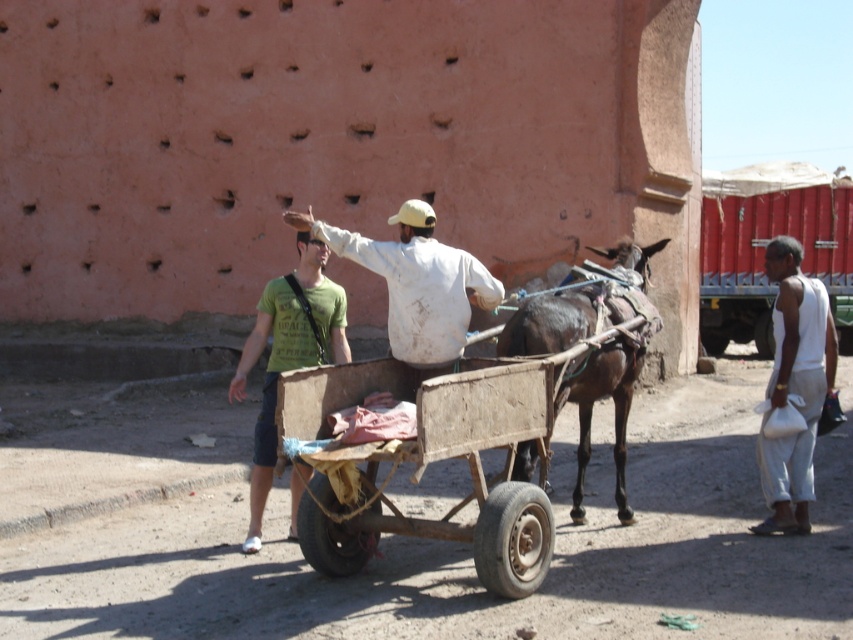
You are standing at the center of the image and want to place a new item at point (793, 385). What object is currently at that location?

The white cotton bag at lower right is located at point (793, 385).